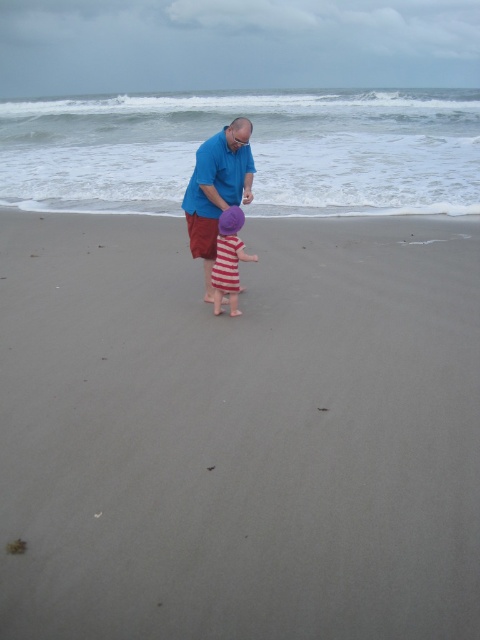
Question: Does smooth sand at center appear under striped fabric dress at center?

Choices:
 (A) yes
 (B) no

Answer: (A)

Question: Among these objects, which one is nearest to the camera?

Choices:
 (A) smooth sand at center
 (B) striped fabric dress at center
 (C) blue cotton shirt at center

Answer: (A)

Question: Which point is farther to the camera?

Choices:
 (A) tap(223, 275)
 (B) tap(179, 244)
 (C) tap(219, 170)

Answer: (B)

Question: Is smooth sand at center smaller than blue cotton shirt at center?

Choices:
 (A) yes
 (B) no

Answer: (B)

Question: Estimate the real-world distances between objects in this image. Which object is closer to the smooth sand at center?

Choices:
 (A) blue cotton shirt at center
 (B) striped fabric dress at center

Answer: (B)

Question: Does smooth sand at center appear under striped fabric dress at center?

Choices:
 (A) yes
 (B) no

Answer: (A)